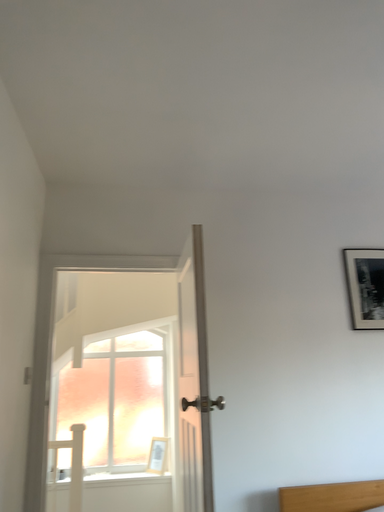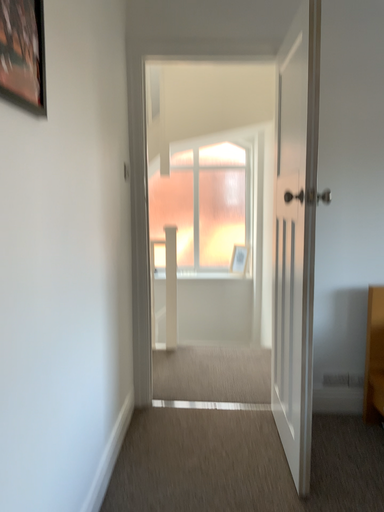
Question: Which way did the camera rotate in the video?

Choices:
 (A) rotated upward
 (B) rotated downward

Answer: (B)